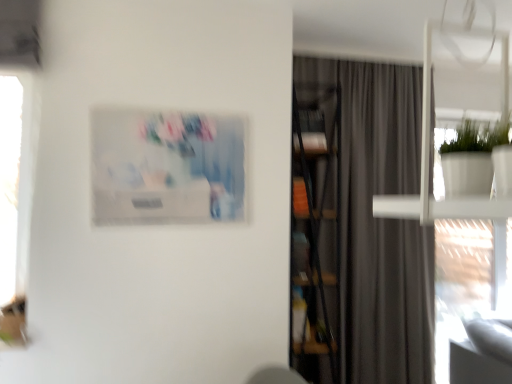
Question: Does wooden bookcase at center have a greater height compared to gray matte curtain at center?

Choices:
 (A) yes
 (B) no

Answer: (B)

Question: Considering the relative sizes of wooden bookcase at center and gray matte curtain at center in the image provided, is wooden bookcase at center smaller than gray matte curtain at center?

Choices:
 (A) yes
 (B) no

Answer: (A)

Question: Is gray matte curtain at center at the back of wooden bookcase at center?

Choices:
 (A) yes
 (B) no

Answer: (A)

Question: From the image's perspective, is wooden bookcase at center located beneath gray matte curtain at center?

Choices:
 (A) no
 (B) yes

Answer: (B)

Question: From a real-world perspective, is wooden bookcase at center located beneath gray matte curtain at center?

Choices:
 (A) no
 (B) yes

Answer: (B)

Question: Based on their sizes in the image, would you say matte plastic picture frame at upper center is bigger or smaller than gray matte curtain at center?

Choices:
 (A) small
 (B) big

Answer: (A)

Question: From the image's perspective, is matte plastic picture frame at upper center positioned above or below gray matte curtain at center?

Choices:
 (A) below
 (B) above

Answer: (B)

Question: Choose the correct answer: Is matte plastic picture frame at upper center inside gray matte curtain at center or outside it?

Choices:
 (A) outside
 (B) inside

Answer: (A)

Question: In the image, is matte plastic picture frame at upper center positioned in front of or behind gray matte curtain at center?

Choices:
 (A) front
 (B) behind

Answer: (A)

Question: Is point (415, 334) closer or farther from the camera than point (116, 175)?

Choices:
 (A) closer
 (B) farther

Answer: (B)

Question: Is gray matte curtain at center taller or shorter than matte plastic picture frame at upper center?

Choices:
 (A) short
 (B) tall

Answer: (B)

Question: Is gray matte curtain at center spatially inside matte plastic picture frame at upper center, or outside of it?

Choices:
 (A) outside
 (B) inside

Answer: (A)

Question: From a real-world perspective, relative to matte plastic picture frame at upper center, is gray matte curtain at center vertically above or below?

Choices:
 (A) below
 (B) above

Answer: (A)

Question: From a real-world perspective, is wooden bookcase at center above or below gray matte curtain at center?

Choices:
 (A) below
 (B) above

Answer: (A)

Question: Considering the positions of wooden bookcase at center and gray matte curtain at center in the image, is wooden bookcase at center bigger or smaller than gray matte curtain at center?

Choices:
 (A) big
 (B) small

Answer: (B)